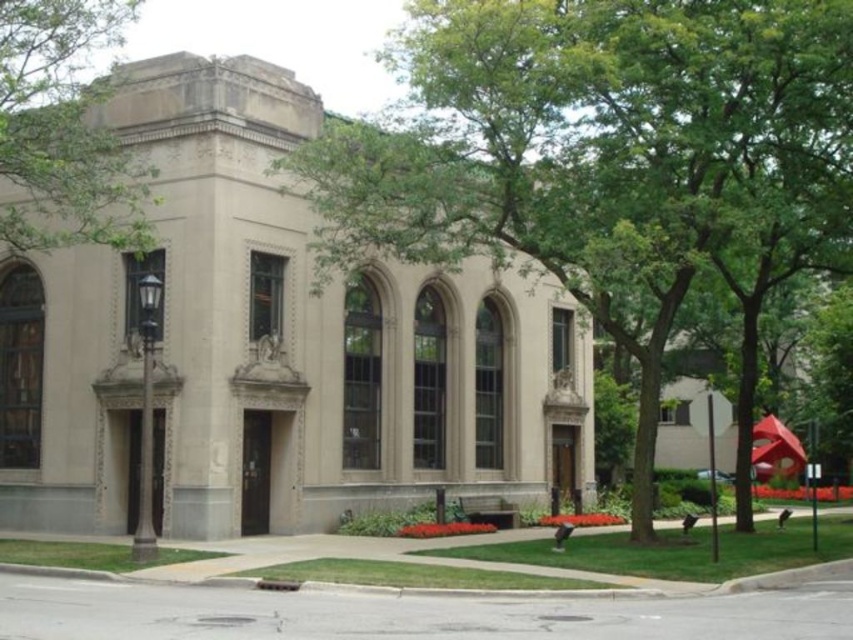
You are standing in front of the historic building and want to know which tree is taller. Can you determine which one between the green leafy tree at center and the green leafy tree at upper center is taller?

The green leafy tree at center is taller than the green leafy tree at upper center according to the description.

You are standing at the entrance of the historic building and want to walk straight ahead. Will you immediately encounter the green leafy tree at center in your path?

The green leafy tree at center is located at point coordinates of (602, 154). Since you are standing at the entrance and walking straight ahead, your path would lead you towards the center of the image. The coordinates of the tree suggest it is positioned near the center, so yes, you would encounter the green leafy tree at center in your path.

You are a gardener planning to water the green leafy tree at center and the green leafy tree at upper center. If your watering hose can reach 30 feet, will you need to move the hose to water both trees?

The distance between the green leafy tree at center and the green leafy tree at upper center is 33.03 feet, which is longer than the 30 feet reach of the hose. Therefore, you will need to move the hose to water both trees.